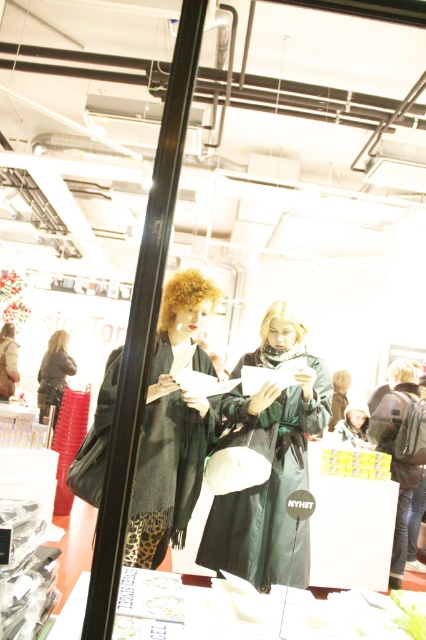
What do you see at coordinates (172, 426) in the screenshot?
I see `green wool scarf at center` at bounding box center [172, 426].

Is green wool scarf at center above leather jacket at left?

Correct, green wool scarf at center is located above leather jacket at left.

At what (x,y) coordinates should I click in order to perform the action: click on green wool scarf at center. Please return your answer as a coordinate pair (x, y). The image size is (426, 640). Looking at the image, I should click on (172, 426).

At what (x,y) coordinates should I click in order to perform the action: click on green wool scarf at center. Please return your answer as a coordinate pair (x, y). The width and height of the screenshot is (426, 640). Looking at the image, I should click on (172, 426).

Where is `green matte coat at center`? Image resolution: width=426 pixels, height=640 pixels. green matte coat at center is located at coordinates (273, 458).

Can you confirm if green matte coat at center is positioned above leather jacket at left?

Yes.

Which is behind, point (268, 355) or point (48, 404)?

Positioned behind is point (48, 404).

Where is `green matte coat at center`? This screenshot has height=640, width=426. green matte coat at center is located at coordinates point(273,458).

Is green matte coat at center thinner than green wool scarf at center?

No.

Which is in front, point (253, 515) or point (172, 426)?

Point (253, 515)

Who is more distant from viewer, [325,404] or [189,342]?

Point [189,342]

Locate an element on the screen. green matte coat at center is located at coordinates (273, 458).